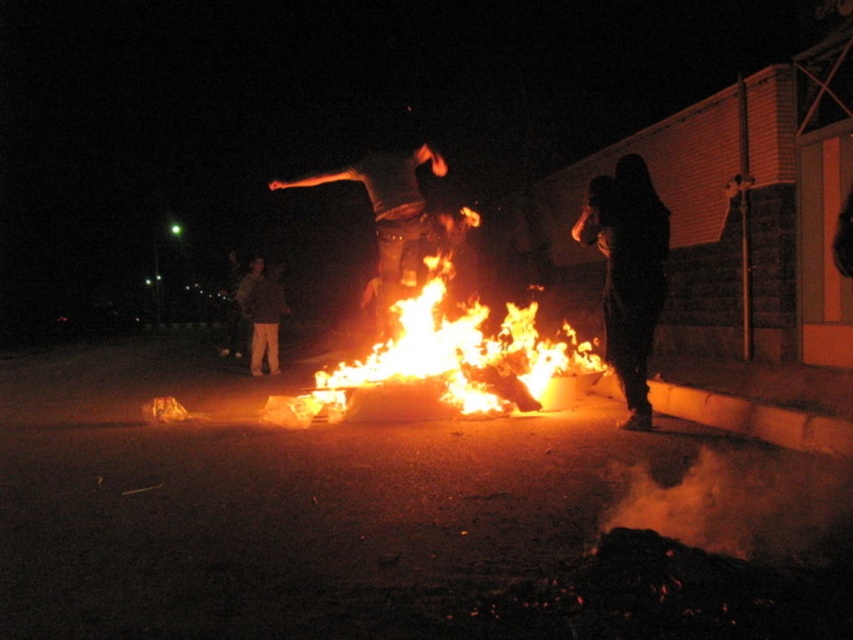
Which is behind, point (352, 368) or point (244, 301)?

The point (244, 301) is behind.

Is flaming wood at center to the left of dark brown fabric pants at lower left from the viewer's perspective?

In fact, flaming wood at center is to the right of dark brown fabric pants at lower left.

Does point (473, 307) lie behind point (251, 368)?

Yes, it is.

Where is `flaming wood at center`? flaming wood at center is located at coordinates [x=438, y=364].

Which is above, black matte figure at right or dark brown fabric pants at lower left?

black matte figure at right is above.

This screenshot has width=853, height=640. In order to click on black matte figure at right in this screenshot , I will do `click(628, 273)`.

Who is shorter, flaming wood at center or black matte figure at right?

With less height is flaming wood at center.

Can you confirm if flaming wood at center is smaller than black matte figure at right?

Correct, flaming wood at center occupies less space than black matte figure at right.

Does point (357, 371) come closer to viewer compared to point (651, 276)?

No.

The width and height of the screenshot is (853, 640). What are the coordinates of `flaming wood at center` in the screenshot? It's located at point(438,364).